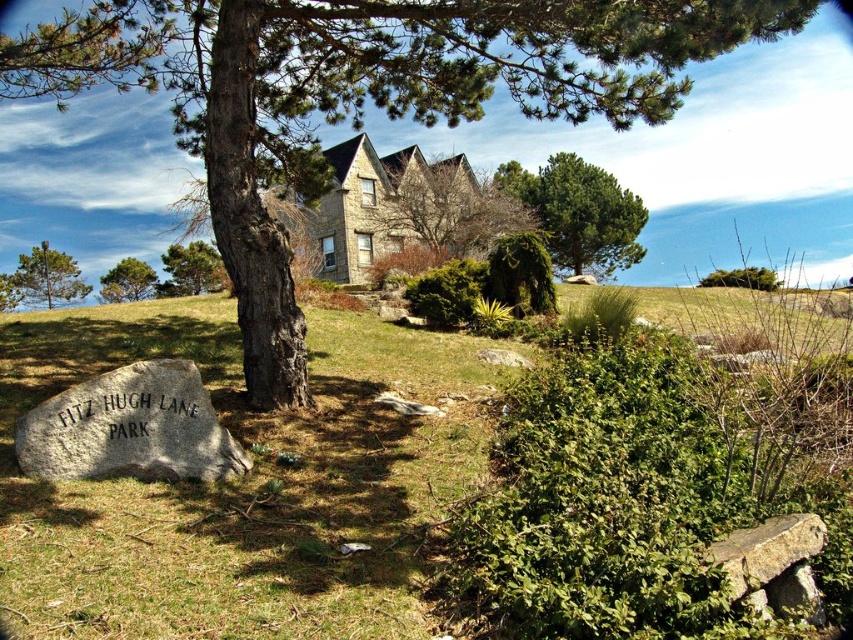
You are standing at the large rock with the park inscription and looking towards the tree. There is a point marked at coordinates (445, 208) in the scene. What object is located at that point?

The point at (445, 208) marks the brown stone house at upper center.

You are planning to install a sprinkler system to water the green grassy at lower left and the green leafy bush at upper right. The sprinkler has a maximum range of 60 feet. Can the sprinkler water both areas from a central location?

The distance between the green grassy at lower left and the green leafy bush at upper right is 64.66 feet. Since the sprinkler can only cover up to 60 feet, it cannot reach both areas from a single central location.